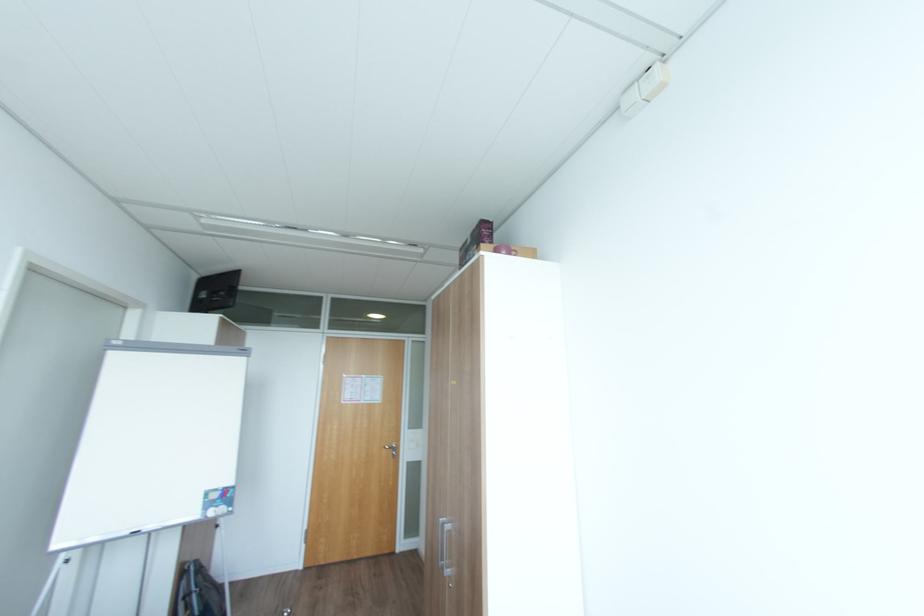
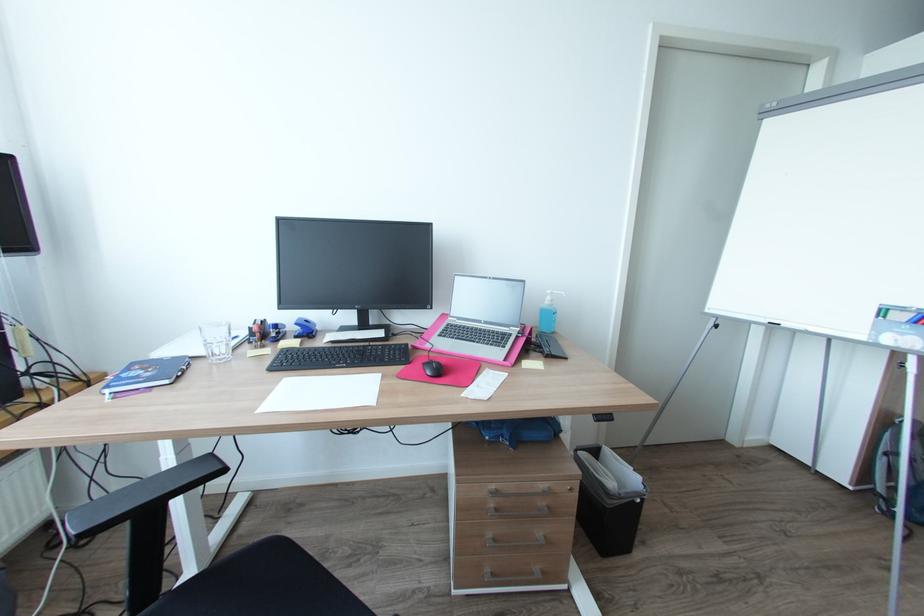
Question: The camera is either moving clockwise (left) or counter-clockwise (right) around the object. The first image is from the beginning of the video and the second image is from the end. Is the camera moving left or right when shooting the video?

Choices:
 (A) Left
 (B) Right

Answer: (B)